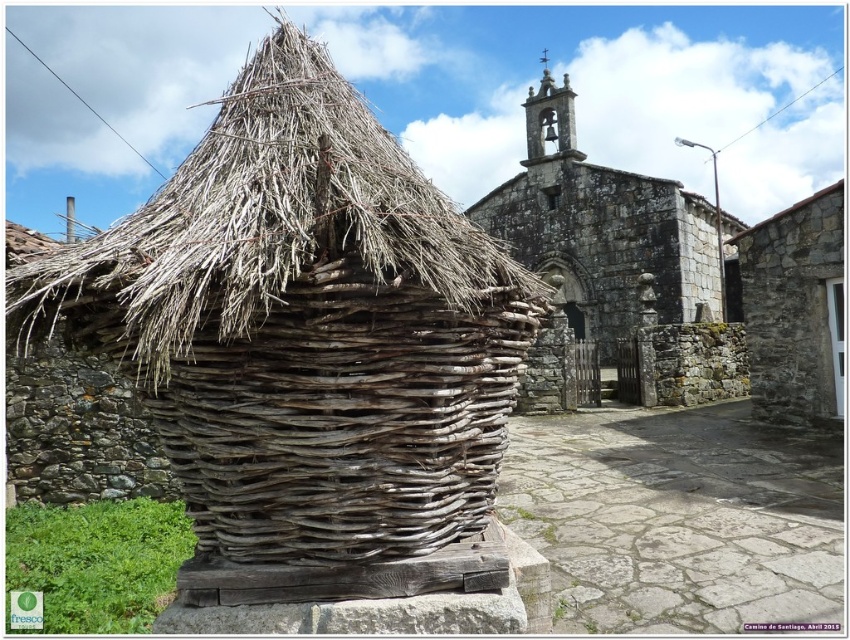
Does brown woven basket at center have a lesser height compared to stone textured church at center?

Yes.

Measure the distance between brown woven basket at center and camera.

A distance of 22.46 meters exists between brown woven basket at center and camera.

Is point (321, 477) closer to camera compared to point (700, 220)?

Yes, it is in front of point (700, 220).

Where is `brown woven basket at center`? The height and width of the screenshot is (640, 850). brown woven basket at center is located at coordinates (343, 417).

Between dry straw roof at center and gray stone wall at right, which one has more height?

dry straw roof at center

Based on the photo, who is lower down, dry straw roof at center or gray stone wall at right?

gray stone wall at right is lower down.

Is point (255, 225) behind point (746, 237)?

No, (255, 225) is closer to viewer.

You are a GUI agent. You are given a task and a screenshot of the screen. Output one action in this format:
    pyautogui.click(x=<x>, y=<y>)
    Task: Click on the dry straw roof at center
    
    Given the screenshot: What is the action you would take?
    pyautogui.click(x=272, y=216)

Does point (336, 522) come behind point (238, 332)?

That is True.

How much distance is there between brown woven basket at center and dry straw roof at center?

3.82 meters

Locate an element on the screen. This screenshot has width=850, height=640. brown woven basket at center is located at coordinates (343, 417).